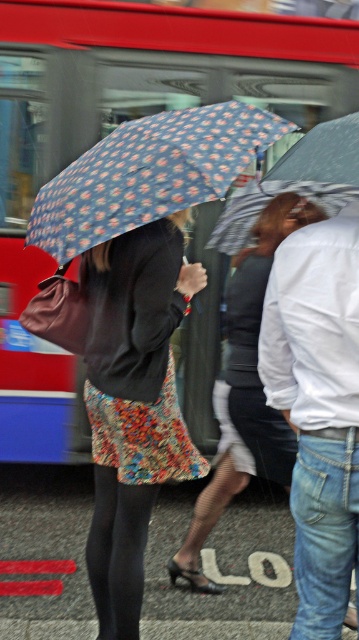
Question: Estimate the real-world distances between objects in this image. Which object is closer to the floral-patterned fabric umbrella at center?

Choices:
 (A) floral-patterned skirt at center
 (B) blue printed fabric umbrella at center

Answer: (B)

Question: Can you confirm if red metallic bus at upper left is thinner than blue printed fabric umbrella at center?

Choices:
 (A) no
 (B) yes

Answer: (A)

Question: Does floral fabric dress at center appear under floral-patterned fabric umbrella at center?

Choices:
 (A) no
 (B) yes

Answer: (B)

Question: Is red metallic bus at upper left above floral-patterned fabric umbrella at center?

Choices:
 (A) no
 (B) yes

Answer: (B)

Question: Among these points, which one is farthest from the camera?

Choices:
 (A) (249, 470)
 (B) (92, 515)
 (C) (63, 257)

Answer: (B)

Question: Which object is positioned farthest from the floral-patterned fabric umbrella at center?

Choices:
 (A) red metallic bus at upper left
 (B) blue printed fabric umbrella at center
 (C) floral-patterned skirt at center

Answer: (A)